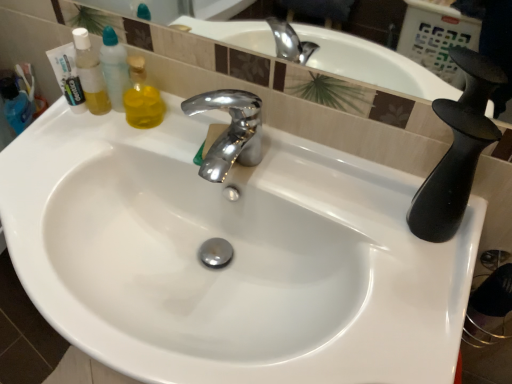
What are the coordinates of `spots to the right of translucent plastic mouthwash at left` in the screenshot? It's located at (173, 134).